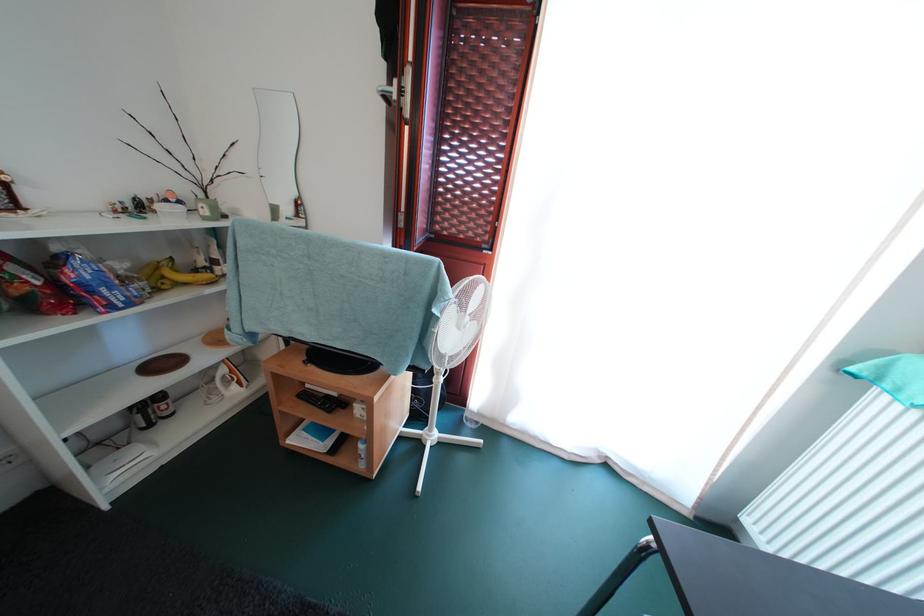
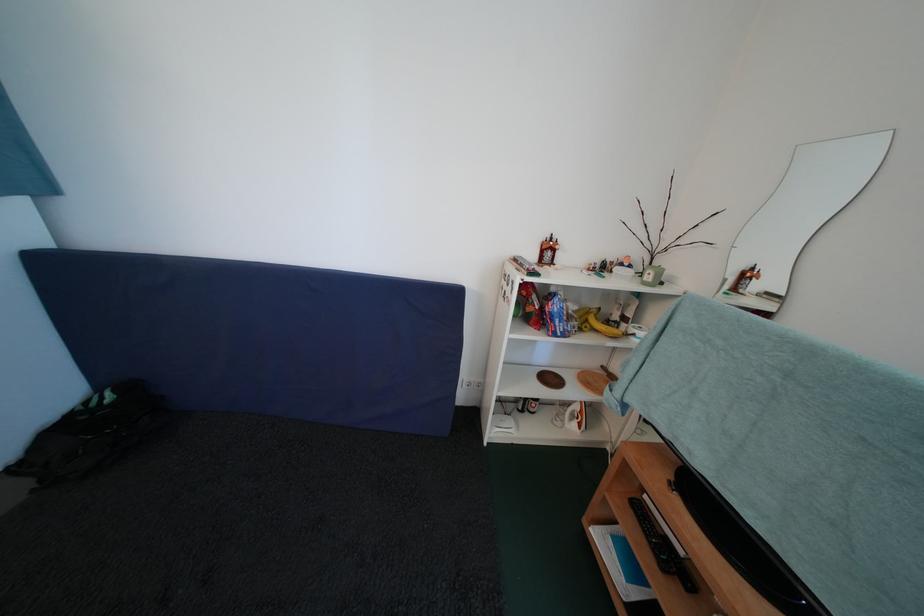
The point at (229, 376) is marked in the first image. Where is the corresponding point in the second image?

(584, 411)